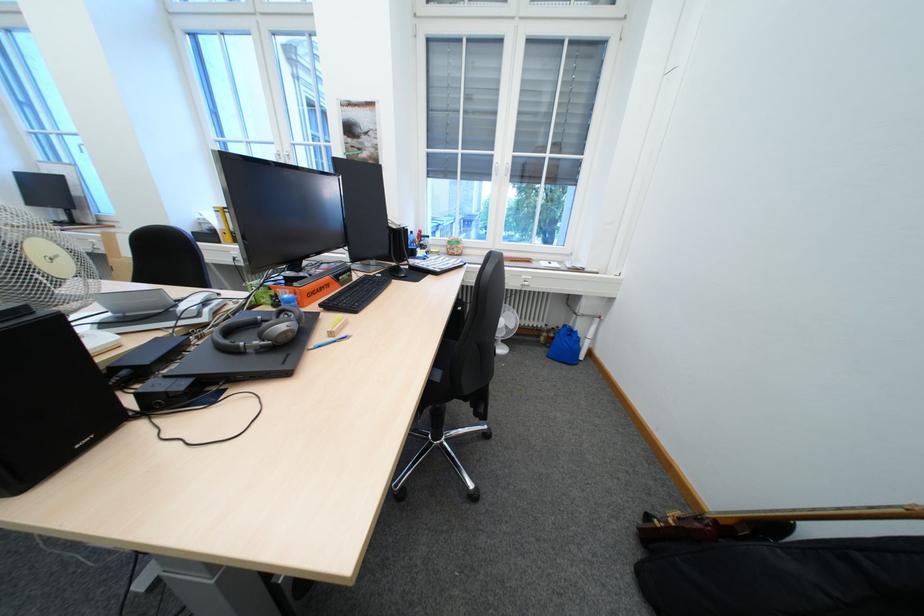
Locate an element on the screen. This screenshot has height=616, width=924. orange cardboard box is located at coordinates (309, 290).